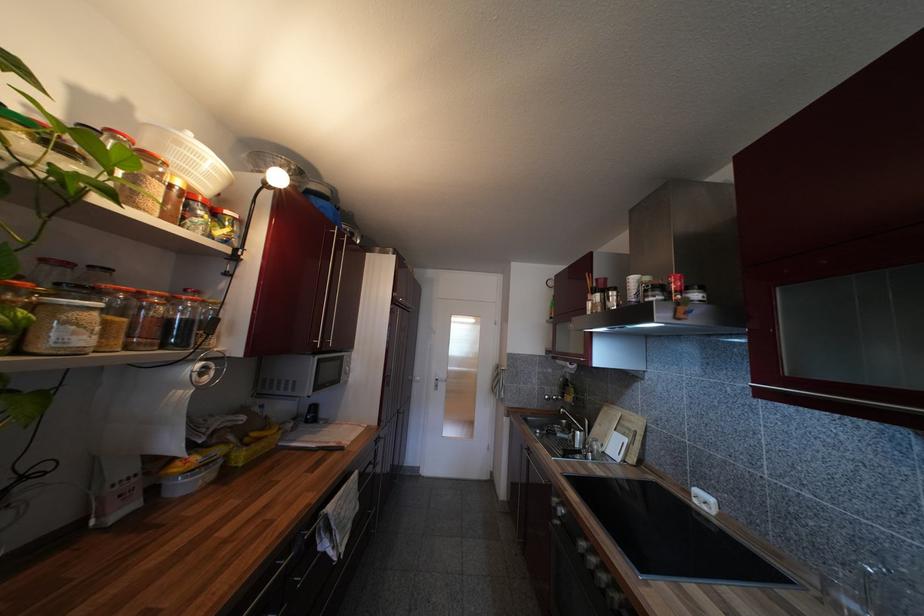
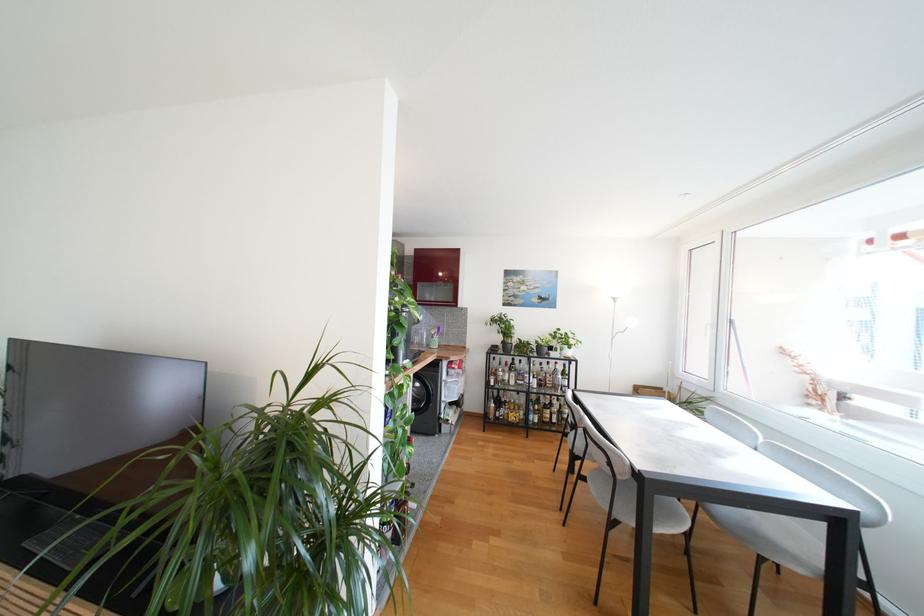
Question: I am providing you with two images of the same scene from different viewpoints. After the viewpoint changes to image2, which objects are now occluded?

Choices:
 (A) white window handle
 (B) silver door handle
 (C) grey chair sitting surface
 (D) net clamp screw

Answer: (B)